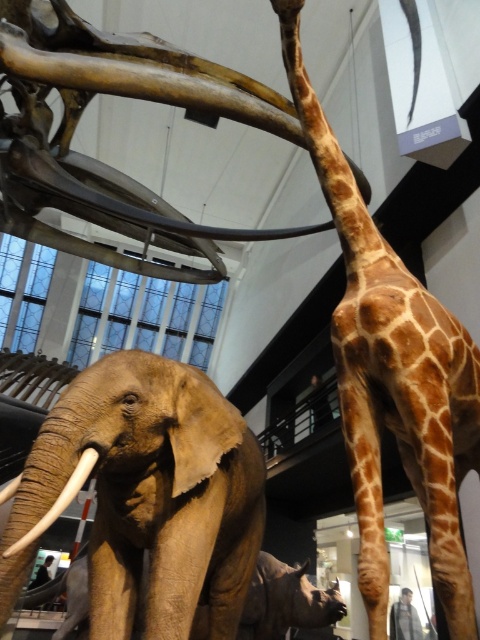
Is brown textured elephant at center wider than brown spotted fur at center?

No, brown textured elephant at center is not wider than brown spotted fur at center.

Is brown textured elephant at center to the right of brown spotted fur at center from the viewer's perspective?

Incorrect, brown textured elephant at center is not on the right side of brown spotted fur at center.

Which is in front, point (239, 449) or point (421, 340)?

Point (421, 340) is more forward.

This screenshot has width=480, height=640. Find the location of `brown textured elephant at center`. brown textured elephant at center is located at coordinates (148, 496).

How far apart are brown textured elephant at center and matte brown tusk at lower left?

brown textured elephant at center is 49.19 centimeters from matte brown tusk at lower left.

Between point (122, 449) and point (94, 461), which one is positioned behind?

Point (122, 449)

Which is behind, point (225, 557) or point (12, 552)?

Point (225, 557)

Where is `brown textured elephant at center`? brown textured elephant at center is located at coordinates (148, 496).

Can you confirm if brown spotted fur at center is taller than matte brown tusk at lower left?

Yes.

Which is in front, point (393, 273) or point (0, 497)?

Point (0, 497)

The width and height of the screenshot is (480, 640). I want to click on brown spotted fur at center, so click(393, 376).

This screenshot has height=640, width=480. In order to click on brown spotted fur at center in this screenshot , I will do `click(393, 376)`.